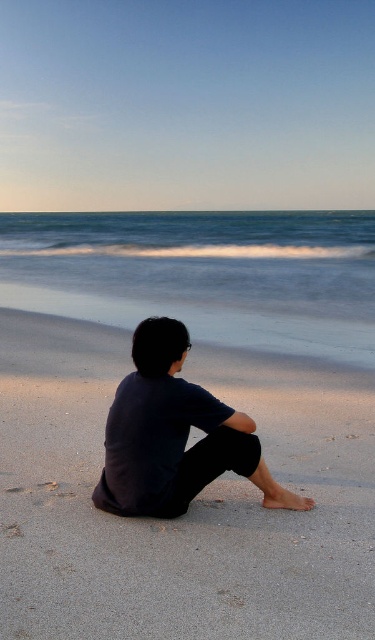
Can you confirm if sandy at lower center is wider than dark blue fabric at center?

No.

Identify the location of sandy at lower center. The width and height of the screenshot is (375, 640). (190, 506).